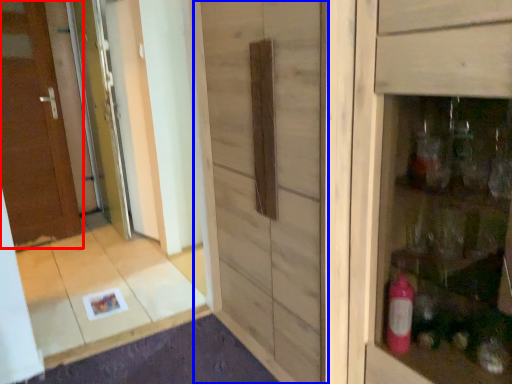
Question: Among these objects, which one is farthest to the camera, door (highlighted by a red box) or barn door (highlighted by a blue box)?

Choices:
 (A) door
 (B) barn door

Answer: (A)